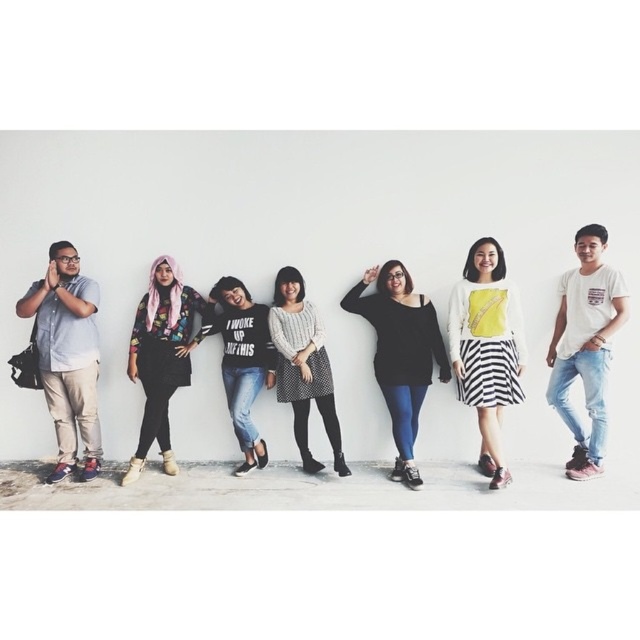
You are standing in front of the group of seven people. There are two points marked on the image. One is at coordinate point (483, 429) and the other at (308, 452). Which point is closer to you?

Point (483, 429) is in front of point (308, 452), so it is closer to you.